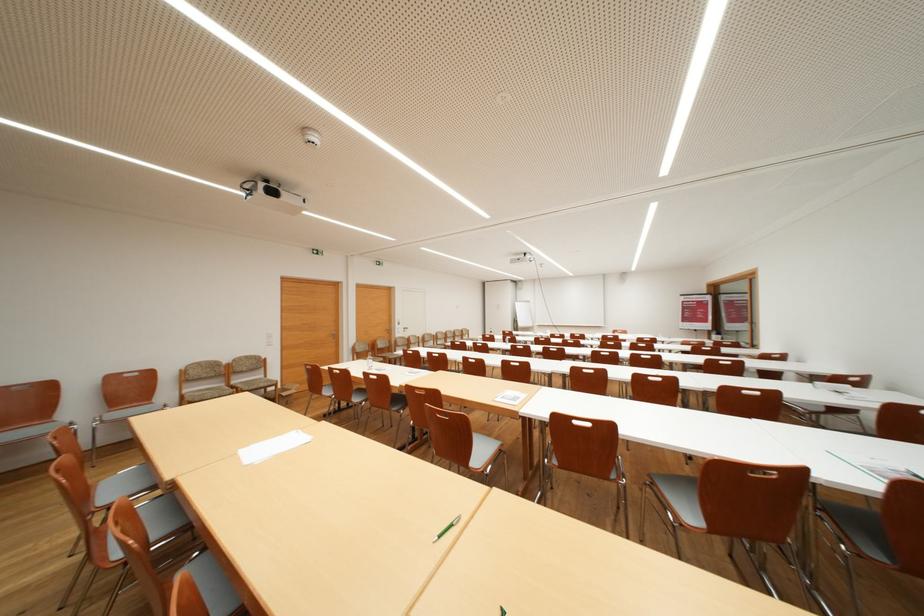
Where would you lift the glass water bottle? Please return your answer as a coordinate pair (x, y).

(369, 362)